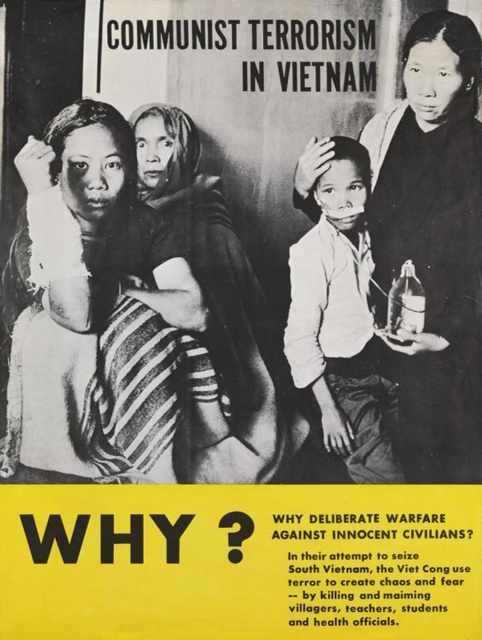
Question: Which of the following is the closest to the observer?

Choices:
 (A) click(80, 330)
 (B) click(395, 204)
 (C) click(332, 442)

Answer: (A)

Question: Does matte black dress at left appear on the left side of smooth black fabric at right?

Choices:
 (A) no
 (B) yes

Answer: (B)

Question: Which point is closer to the camera taking this photo?

Choices:
 (A) (419, 68)
 (B) (346, 301)
 (C) (196, 224)

Answer: (A)

Question: Can you confirm if matte black dress at left is thinner than white matte shirt at center?

Choices:
 (A) yes
 (B) no

Answer: (B)

Question: Which point appears farthest from the camera in this image?

Choices:
 (A) (414, 435)
 (B) (276, 458)
 (C) (391, 461)

Answer: (A)

Question: Is matte black dress at left thinner than smooth black fabric at right?

Choices:
 (A) no
 (B) yes

Answer: (A)